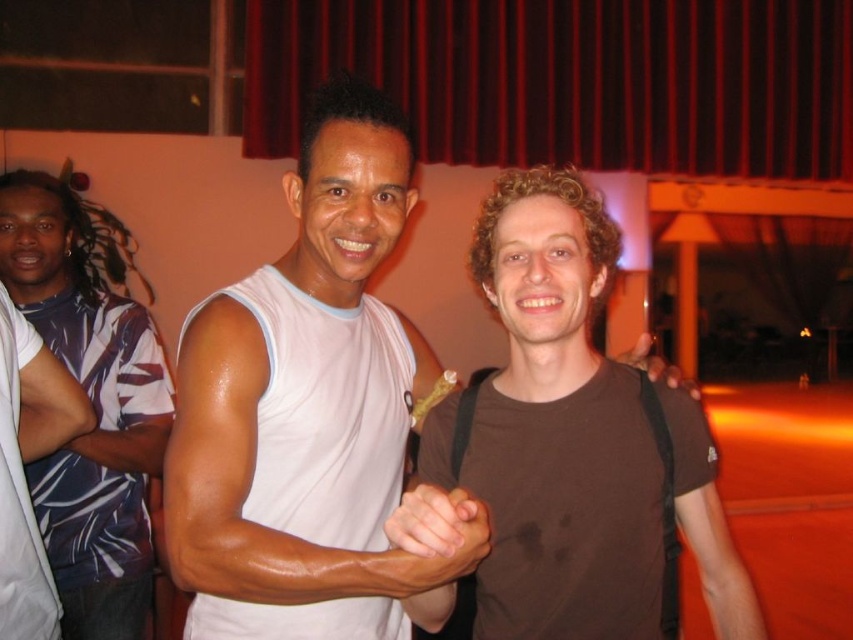
Question: Which of the following is the closest to the observer?

Choices:
 (A) (505, 161)
 (B) (184, 528)
 (C) (715, 525)
 (D) (77, 397)

Answer: (B)

Question: Which of the following is the closest to the observer?

Choices:
 (A) (334, 563)
 (B) (146, 588)

Answer: (A)

Question: Which object is the farthest from the blue striped shirt at left?

Choices:
 (A) white matte tank top at center
 (B) white smooth tank top at center
 (C) brown matte t-shirt at center

Answer: (C)

Question: Does red velvet curtain at upper center have a smaller size compared to white matte shirt at center?

Choices:
 (A) yes
 (B) no

Answer: (B)

Question: Where is red velvet curtain at upper center located in relation to brown fabric arm at center in the image?

Choices:
 (A) below
 (B) above

Answer: (B)

Question: Observing the image, what is the correct spatial positioning of red velvet curtain at upper center in reference to white matte shirt at upper left?

Choices:
 (A) above
 (B) below

Answer: (A)